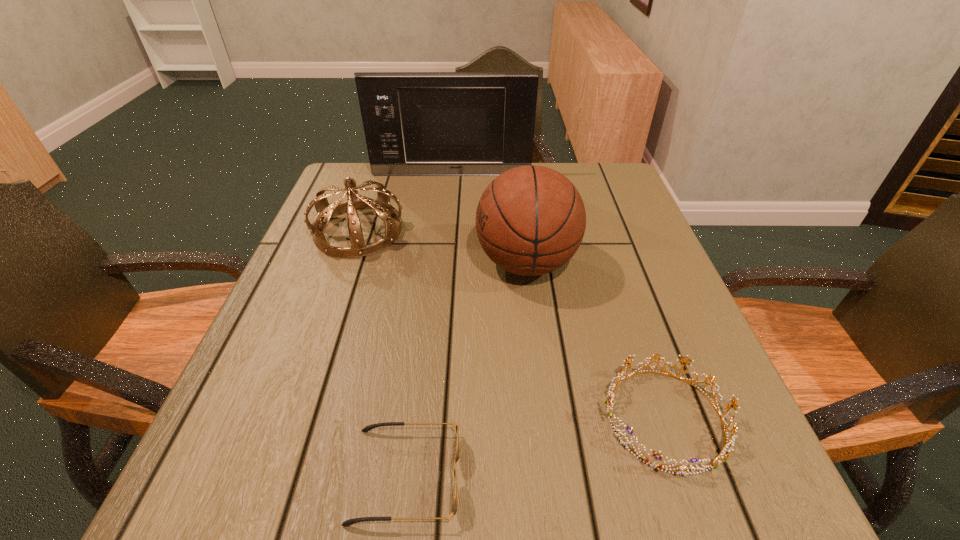
Find the location of a particular element. The image size is (960, 540). free space located on the side with brand label of the second tallest object is located at coordinates (298, 263).

Where is `free space located 0.290m on the side with brand label of the second tallest object`? The image size is (960, 540). free space located 0.290m on the side with brand label of the second tallest object is located at coordinates (344, 263).

Locate an element on the screen. The height and width of the screenshot is (540, 960). vacant space situated 0.240m on the right of the left tiara is located at coordinates (504, 231).

You are a GUI agent. You are given a task and a screenshot of the screen. Output one action in this format:
    pyautogui.click(x=<x>, y=<y>)
    Task: Click on the vacant space located 0.320m on the front-facing side of the shorter tiara
    
    Given the screenshot: What is the action you would take?
    pyautogui.click(x=397, y=418)

This screenshot has width=960, height=540. Find the location of `vacant area situated 0.280m on the front-facing side of the shorter tiara`. vacant area situated 0.280m on the front-facing side of the shorter tiara is located at coordinates (423, 418).

This screenshot has width=960, height=540. I want to click on vacant space located on the front-facing side of the shorter tiara, so click(x=539, y=418).

The height and width of the screenshot is (540, 960). I want to click on free location located 0.190m on the front-facing side of the sunglasses, so click(x=593, y=475).

Identify the location of microwave oven that is at the far edge. (416, 123).

Image resolution: width=960 pixels, height=540 pixels. I want to click on tiara that is at the far edge, so click(381, 205).

Locate an element on the screen. The width and height of the screenshot is (960, 540). tiara located in the near edge section of the desktop is located at coordinates (722, 457).